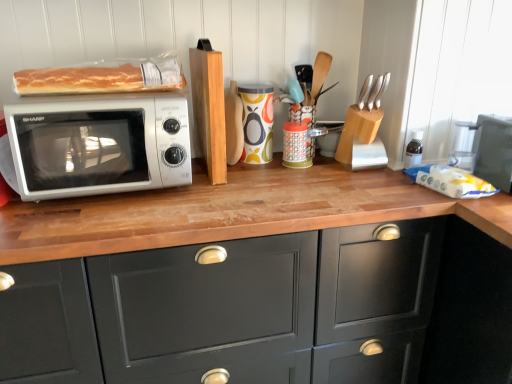
I want to click on free space in front of colorful ceramic mug at center, which ranks as the 4th appliance in right-to-left order, so click(271, 174).